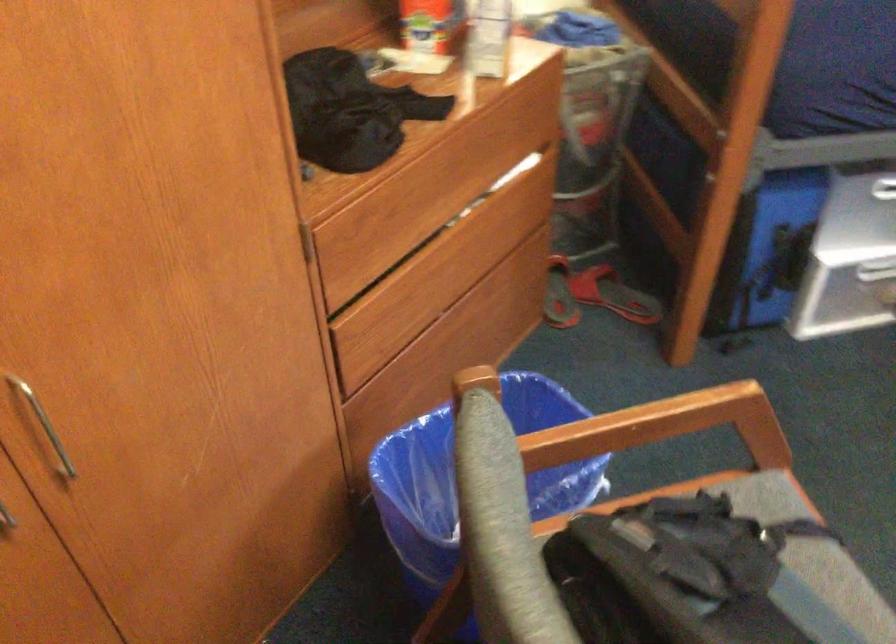
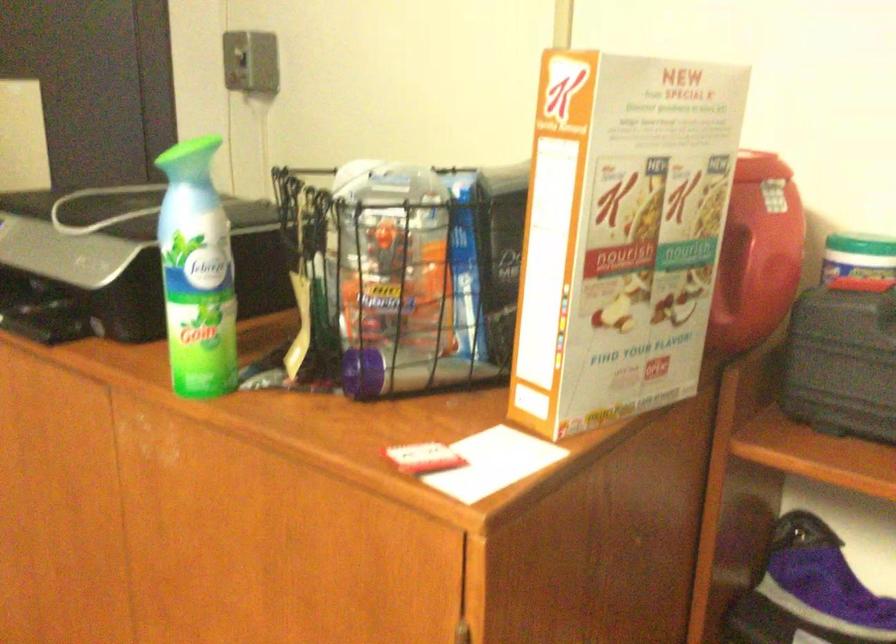
Question: The images are taken continuously from a first-person perspective. In which direction is your viewpoint rotating?

Choices:
 (A) Left
 (B) Right
 (C) Up
 (D) Down

Answer: (A)